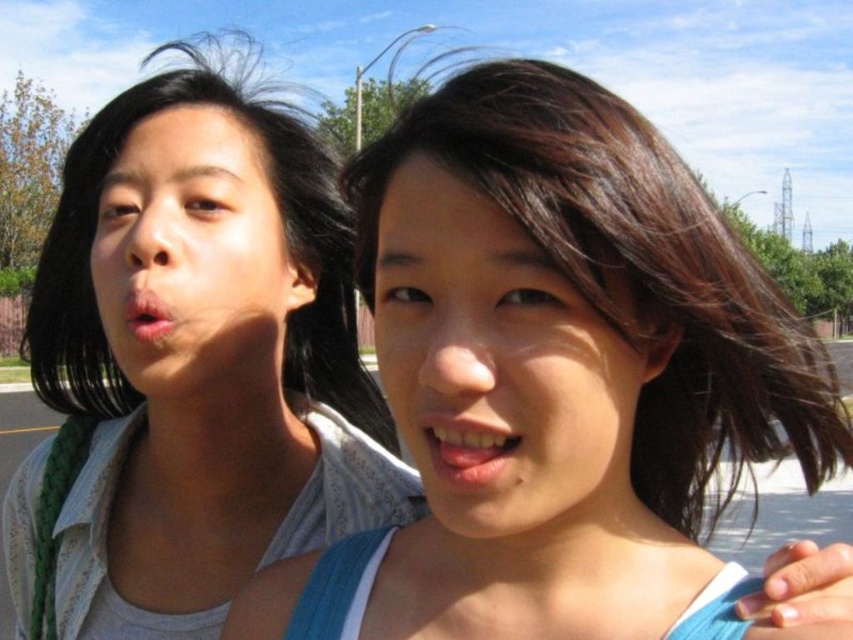
You are a photographer trying to focus on the matte white shirt at left. What coordinates should you adjust your camera to aim at?

You should aim your camera at the coordinates point (x=192, y=371) to focus on the matte white shirt at left.

You are a photographer trying to capture a group photo of the matte white shirt at left and the smooth skin face at center. Since you want both subjects to appear equally sized in the photo, which subject should you move closer to the camera?

The matte white shirt at left is wider than the smooth skin face at center, so to make them appear the same size in the photo, you should move the smooth skin face at center closer to the camera.